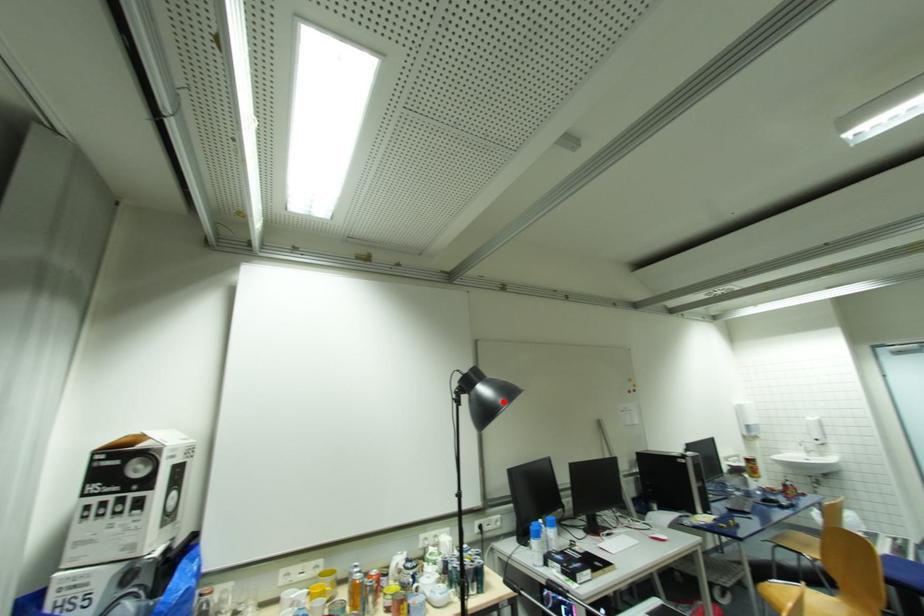
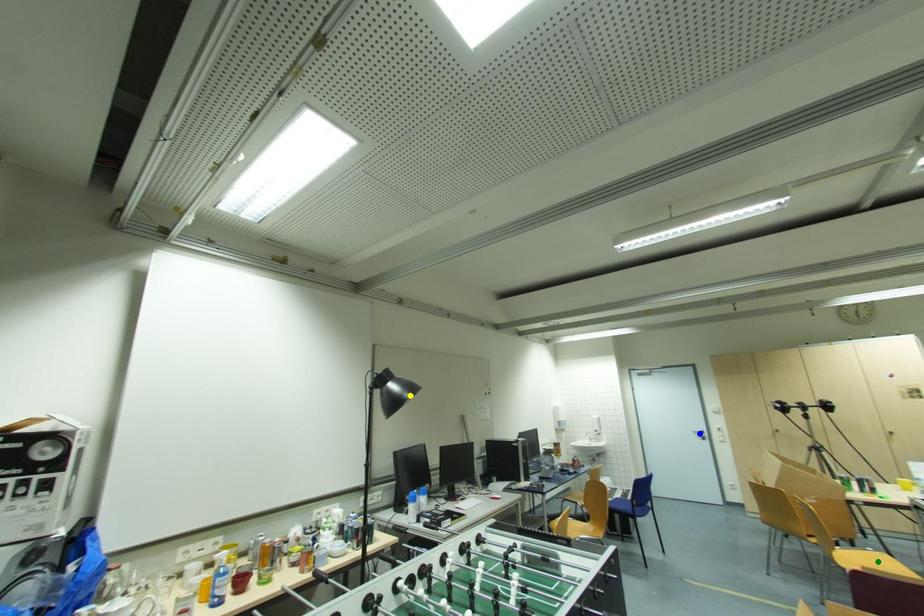
Question: I am providing you with two images of the same scene from different viewpoints. A red point is marked on the first image. You are given multiple points on the second image. Which point in image 2 represents the same 3d spot as the red point in image 1?

Choices:
 (A) green point
 (B) blue point
 (C) yellow point

Answer: (C)